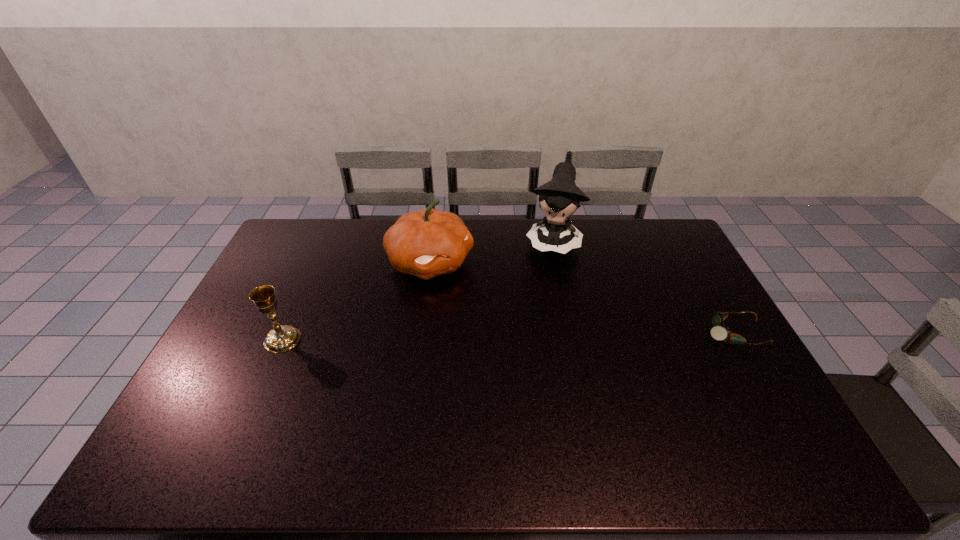
I want to click on free region at the near edge of the desktop, so click(561, 422).

The width and height of the screenshot is (960, 540). In the image, there is a desktop. Identify the location of vacant space at the left edge. (242, 381).

You are a GUI agent. You are given a task and a screenshot of the screen. Output one action in this format:
    pyautogui.click(x=<x>, y=<y>)
    Task: Click on the vacant space at the right edge
    
    Given the screenshot: What is the action you would take?
    (734, 346)

You are a GUI agent. You are given a task and a screenshot of the screen. Output one action in this format:
    pyautogui.click(x=<x>, y=<y>)
    Task: Click on the free space at the far left corner of the desktop
    This screenshot has height=540, width=960.
    Given the screenshot: What is the action you would take?
    pyautogui.click(x=307, y=252)

Locate an element on the screen. This screenshot has height=540, width=960. free area in between the third tallest object and the pumpkin is located at coordinates [356, 301].

Identify the location of free space between the pumpkin and the leftmost object. (356, 301).

You are a GUI agent. You are given a task and a screenshot of the screen. Output one action in this format:
    pyautogui.click(x=<x>, y=<y>)
    Task: Click on the empty space between the shortest object and the pumpkin
    
    Given the screenshot: What is the action you would take?
    coord(582,298)

Locate an element on the screen. The image size is (960, 540). vacant space in between the tallest object and the spectacles is located at coordinates (643, 287).

In order to click on free spot between the pumpkin and the spectacles in this screenshot , I will do coord(582,298).

Where is `unoccupied position between the third object from left to right and the rightmost object`? The image size is (960, 540). unoccupied position between the third object from left to right and the rightmost object is located at coordinates (643, 287).